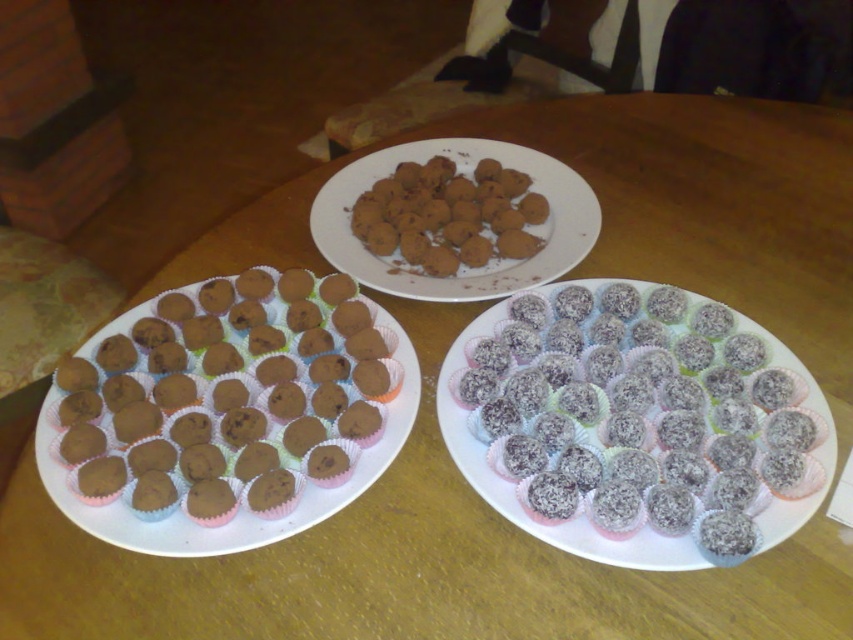
Question: Is white coconut-coated muffins at center to the right of chocolate matte muffins at left from the viewer's perspective?

Choices:
 (A) no
 (B) yes

Answer: (B)

Question: Is white coconut-coated muffins at center to the left of brown matte chocolate truffles at center from the viewer's perspective?

Choices:
 (A) no
 (B) yes

Answer: (A)

Question: Which point is closer to the camera taking this photo?

Choices:
 (A) (531, 177)
 (B) (254, 400)
 (C) (622, 433)

Answer: (C)

Question: Which object is farther from the camera taking this photo?

Choices:
 (A) brown matte chocolate truffles at center
 (B) white coconut-coated muffins at center
 (C) chocolate matte muffins at left

Answer: (A)

Question: Among these objects, which one is farthest from the camera?

Choices:
 (A) white coconut-coated muffins at center
 (B) chocolate matte muffins at left
 (C) brown matte chocolate truffles at center

Answer: (C)

Question: Is chocolate matte muffins at left positioned in front of brown matte chocolate truffles at center?

Choices:
 (A) no
 (B) yes

Answer: (B)